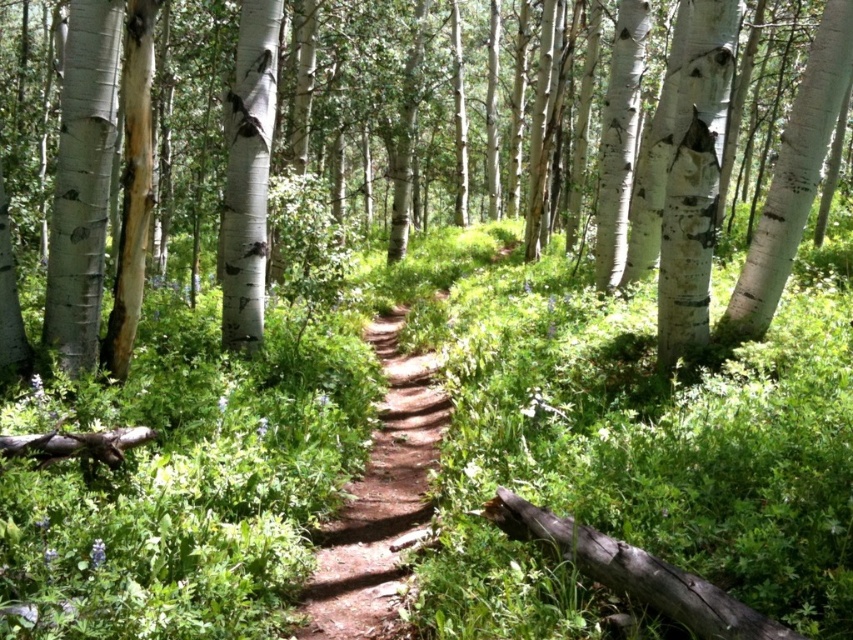
You are a hiker who wants to take a photo of both the white smooth tree at center and the white smooth tree trunk at center. Since you have a camera with a fixed focal length, you need to know which one is larger to ensure both fit in the frame. Can you tell me which one is bigger?

The white smooth tree at center is bigger than the white smooth tree trunk at center, so you should position your camera to focus on the larger one to ensure both fit in the frame.